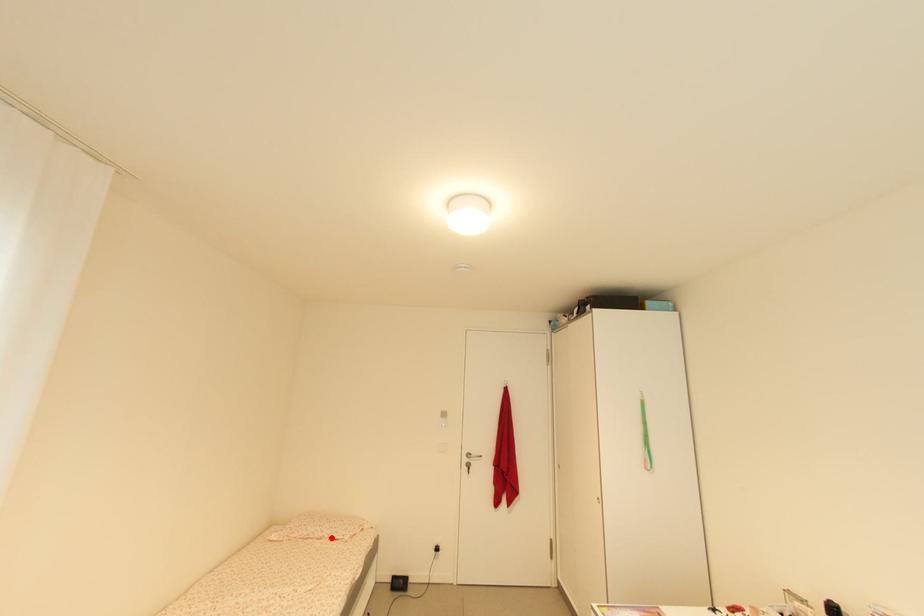
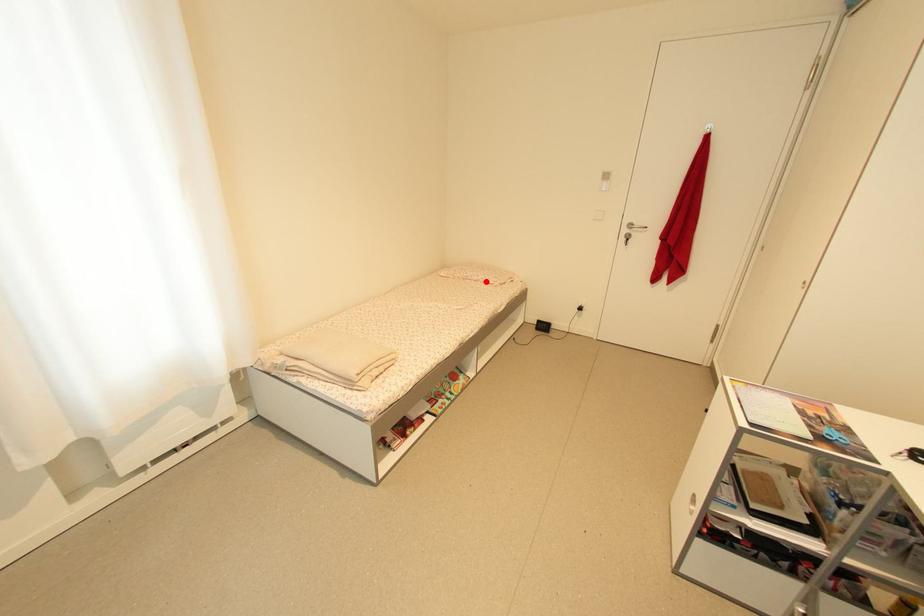
I am providing you with two images of the same scene from different viewpoints. A red point is marked on the first image and another point is marked on the second image. Does the point marked in image1 correspond to the same location as the one in image2?

Yes